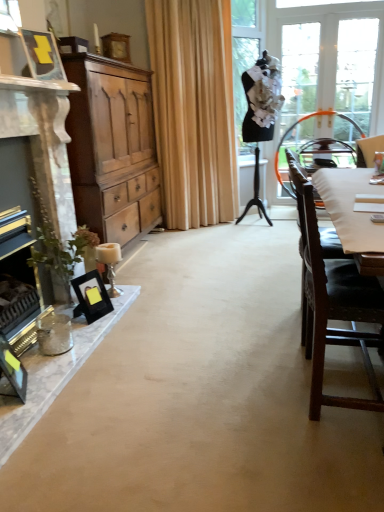
Question: Considering the positions of matte brown cabinet at left and matte black picture frame at upper left, marked as the third picture frame in a back-to-front arrangement, in the image, is matte brown cabinet at left bigger or smaller than matte black picture frame at upper left, marked as the third picture frame in a back-to-front arrangement,?

Choices:
 (A) small
 (B) big

Answer: (B)

Question: From the image's perspective, is matte brown cabinet at left located above or below matte black picture frame at upper left, marked as the third picture frame in a back-to-front arrangement?

Choices:
 (A) above
 (B) below

Answer: (B)

Question: Which object is the farthest from the matte brown cabinet at left?

Choices:
 (A) clear glass window at upper right
 (B) beige fabric curtain at center
 (C) matte black picture frame at upper left, arranged as the 3th picture frame when ordered from the bottom
 (D) wooden chair at right, marked as the 1th chair in a top-to-bottom arrangement
 (E) black matte picture frame at lower left, which appears as the third picture frame when viewed from the front

Answer: (A)

Question: Which object is the closest to the matte black picture frame at lower left, which ranks as the 4th picture frame in back-to-front order?

Choices:
 (A) wooden chair at right, marked as the 1th chair in a top-to-bottom arrangement
 (B) matte brown cabinet at left
 (C) metallic silver fireplace at left
 (D) beige fabric curtain at center
 (E) clear glass window at upper right

Answer: (C)